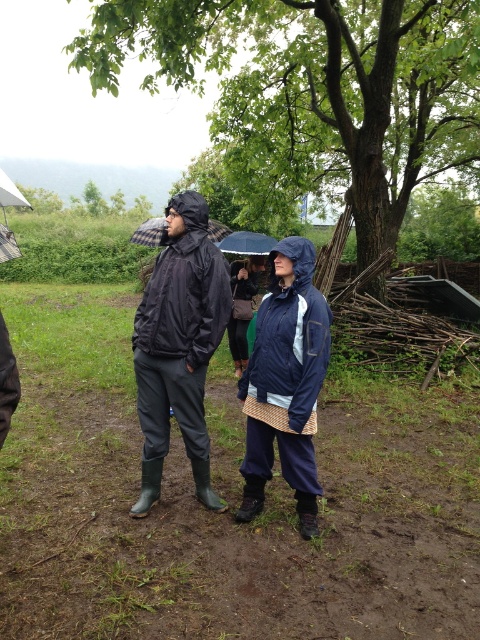
You are a photographer trying to capture a photo of both the matte black jacket at center and the navy blue waterproof jacket at center. Since the scene is under overcast weather, you want to ensure both jackets are fully visible in your photo. Based on their positions, which jacket might be more challenging to capture clearly and why?

The navy blue waterproof jacket at center might be more challenging to capture clearly because the matte black jacket at center is located above it, potentially blocking part of the navy blue jacket from view.

You are standing in the scene and want to walk towards the matte black jacket at center. Which direction should you move relative to the white matte umbrella at upper left?

To reach the matte black jacket at center, you should move to the right of the white matte umbrella at upper left since the matte black jacket at center is positioned to the right of it.